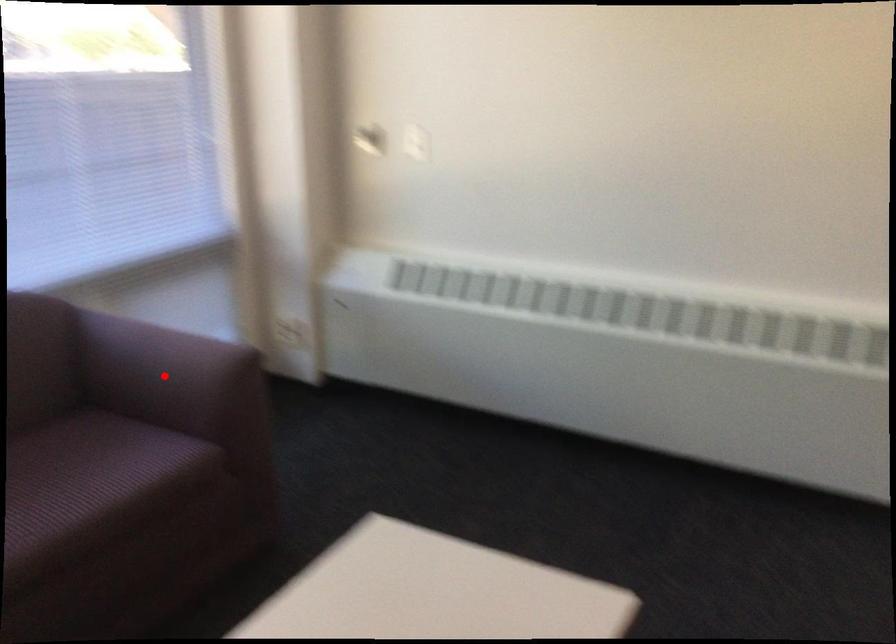
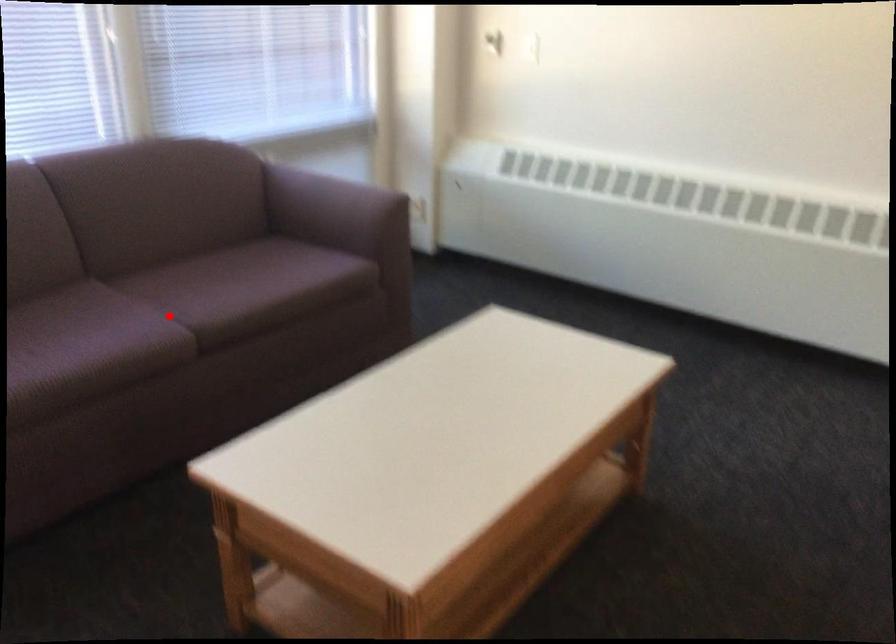
I am providing you with two images of the same scene from different viewpoints. A red point is marked on the first image and another point is marked on the second image. Is the marked point in image1 the same physical position as the marked point in image2?

No